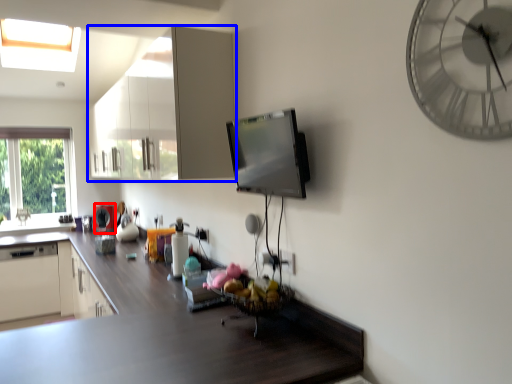
Question: Which object appears closest to the camera in this image, appliance (highlighted by a red box) or cabinetry (highlighted by a blue box)?

Choices:
 (A) appliance
 (B) cabinetry

Answer: (B)